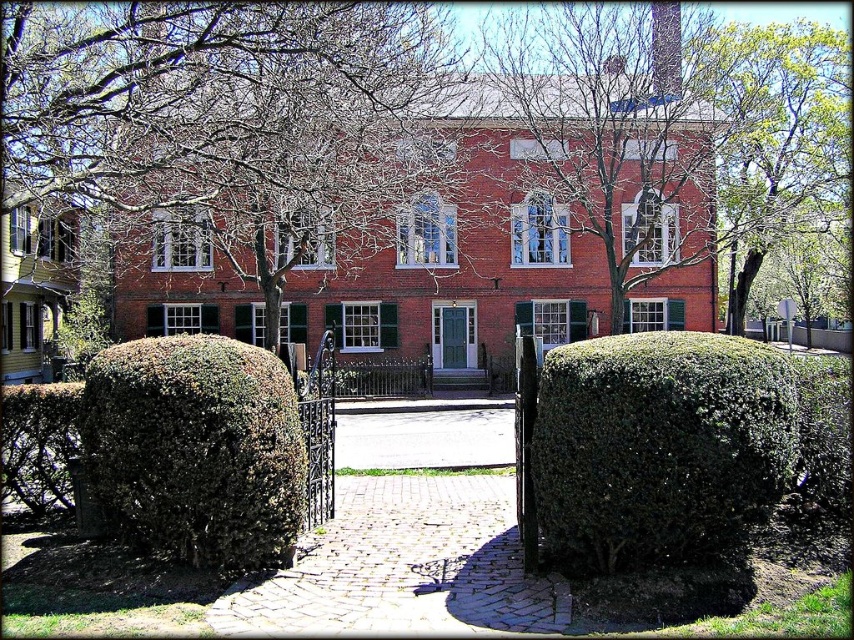
Question: Which of these objects is positioned closest to the green leafy hedge at center?

Choices:
 (A) green leafy hedge at lower left
 (B) green leafy bush at center
 (C) bare branches at center
 (D) green leafy tree at upper right

Answer: (B)

Question: Which of these objects is positioned farthest from the green leafy tree at upper right?

Choices:
 (A) green leafy hedge at lower left
 (B) green leafy bush at center
 (C) green leafy hedge at center
 (D) bare branches at center

Answer: (A)

Question: Considering the relative positions of green leafy hedge at center and green leafy hedge at lower left in the image provided, where is green leafy hedge at center located with respect to green leafy hedge at lower left?

Choices:
 (A) left
 (B) right

Answer: (B)

Question: Considering the real-world distances, which object is closest to the green leafy bush at center?

Choices:
 (A) bare branches at center
 (B) green leafy tree at upper right

Answer: (A)

Question: Is bare branches at center positioned at the back of green leafy hedge at lower left?

Choices:
 (A) yes
 (B) no

Answer: (A)

Question: Observing the image, what is the correct spatial positioning of green leafy hedge at center in reference to green leafy tree at upper right?

Choices:
 (A) right
 (B) left

Answer: (B)